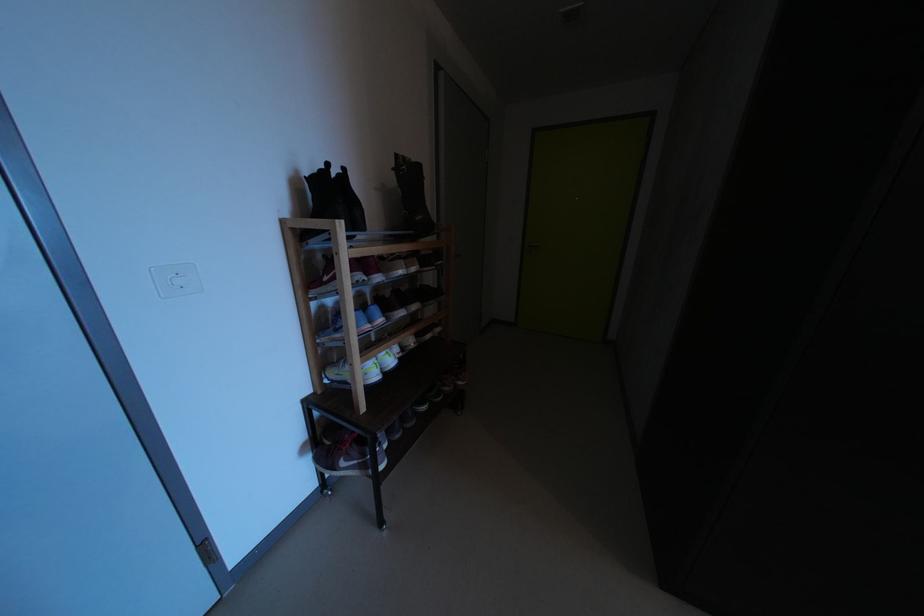
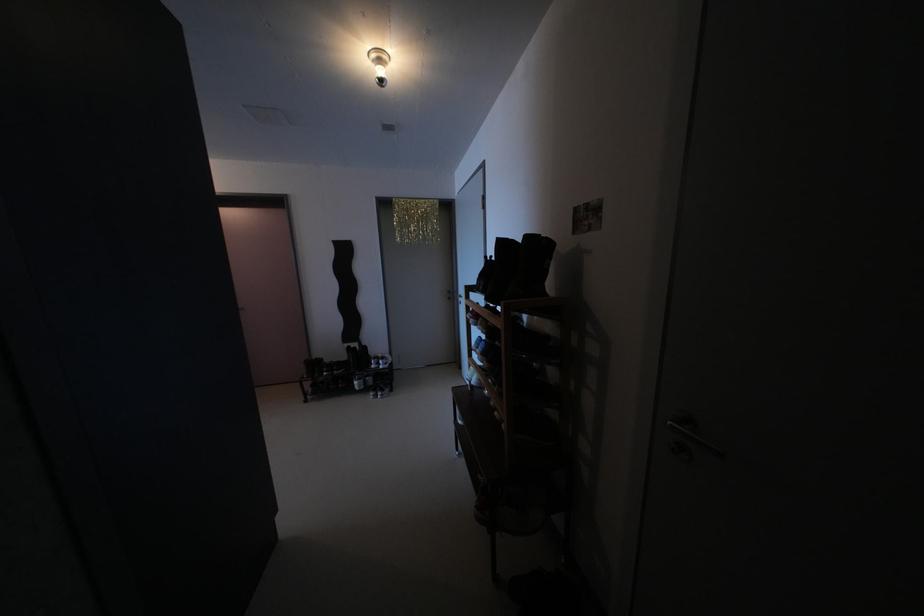
Locate, in the second image, the point that corresponds to the point at 358,175 in the first image.

(504, 262)